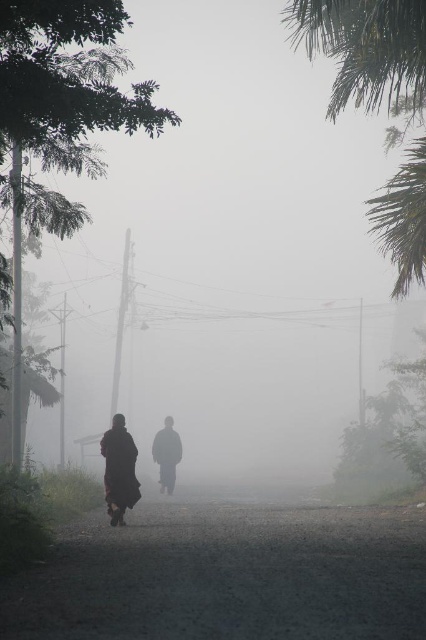
Question: Which object appears closest to the camera in this image?

Choices:
 (A) dark gravel road at center
 (B) dark matte monk at center
 (C) dark red robe at center
 (D) green leafy palm tree at upper right

Answer: (A)

Question: Among these points, which one is farthest from the camera?

Choices:
 (A) (408, 228)
 (B) (270, 541)

Answer: (A)

Question: Is dark red robe at center smaller than dark brown robe at center?

Choices:
 (A) yes
 (B) no

Answer: (B)

Question: Is dark red robe at center wider than dark matte monk at center?

Choices:
 (A) yes
 (B) no

Answer: (A)

Question: Which of these objects is positioned closest to the dark matte monk at center?

Choices:
 (A) dark red robe at center
 (B) dark gravel road at center
 (C) dark brown robe at center

Answer: (A)

Question: Observing the image, what is the correct spatial positioning of dark gravel road at center in reference to dark matte monk at center?

Choices:
 (A) right
 (B) left

Answer: (A)